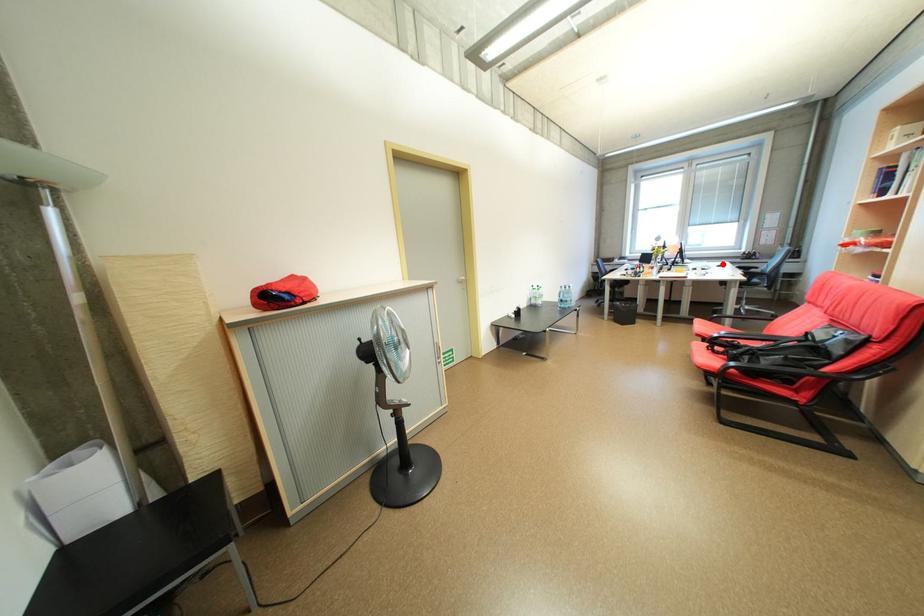
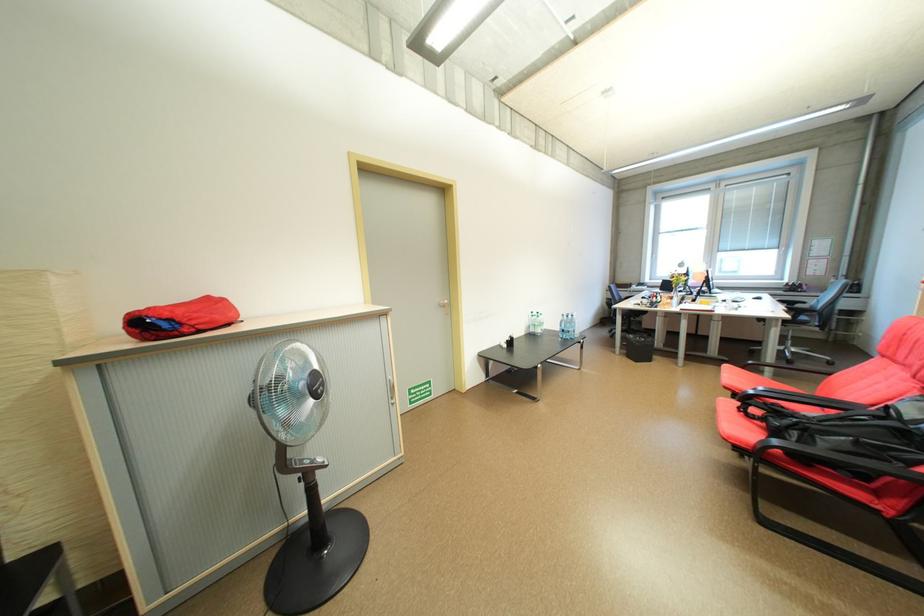
The point at the highlighted location is marked in the first image. Where is the corresponding point in the second image?

(758, 296)